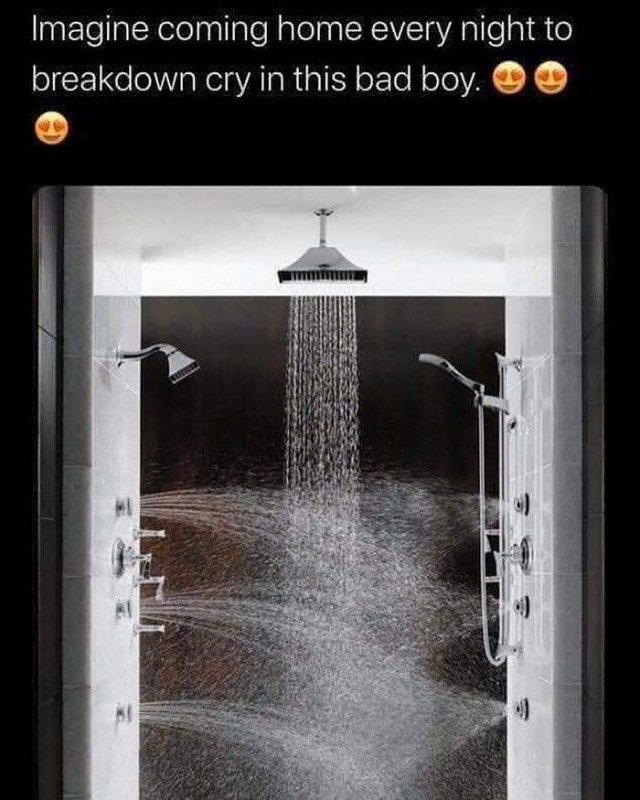
Find the location of a particular element. background black wall is located at coordinates [242, 421], [404, 418].